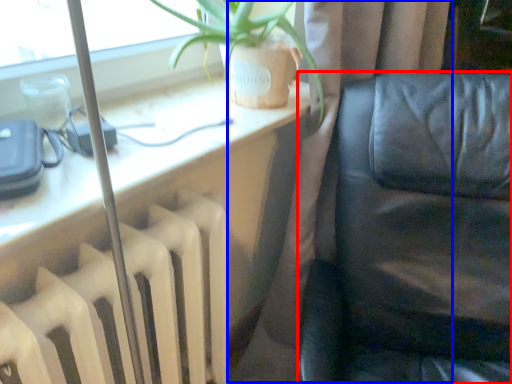
Question: Which object appears closest to the camera in this image, furniture (highlighted by a red box) or curtain (highlighted by a blue box)?

Choices:
 (A) furniture
 (B) curtain

Answer: (A)